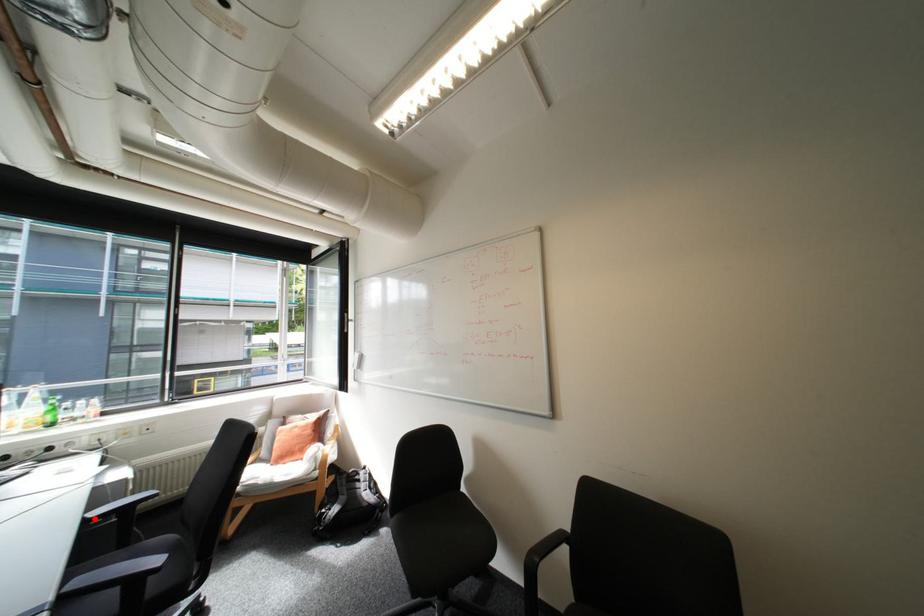
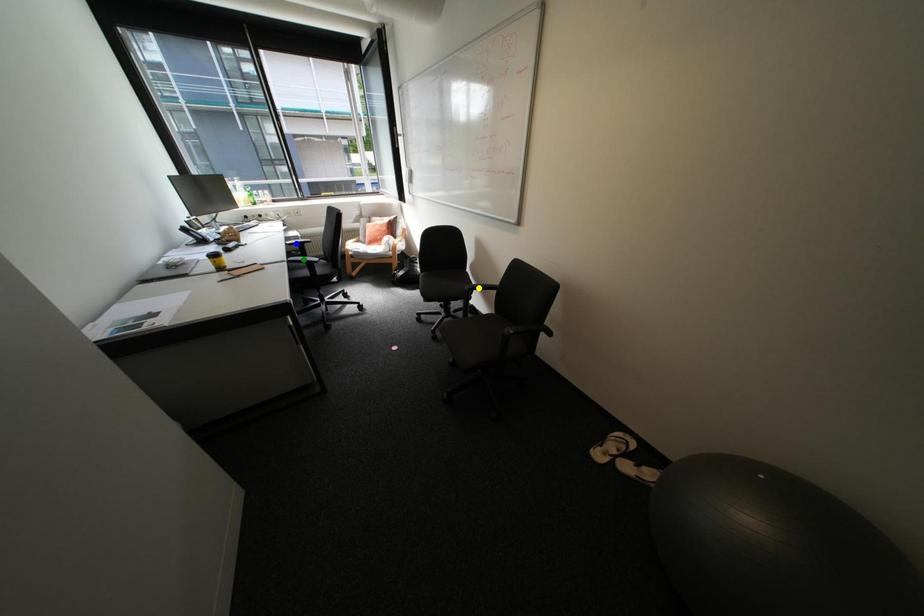
Question: I am providing you with two images of the same scene from different viewpoints. A red point is marked on the first image. You are given multiple points on the second image. Which spot in image 2 lines up with the point in image 1?

Choices:
 (A) green point
 (B) blue point
 (C) yellow point

Answer: (B)